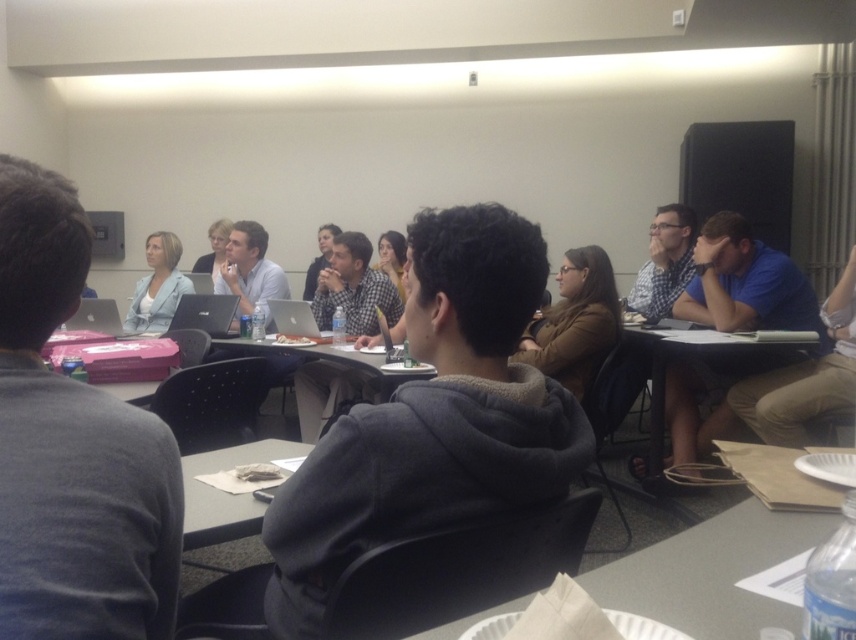
Question: Which of the following is the farthest from the observer?

Choices:
 (A) blue cotton shirt at right
 (B) gray fleece hoodie at center
 (C) white paper plate at lower center

Answer: (A)

Question: Which is farther from the matte black jacket at center?

Choices:
 (A) light blue blazer at upper left
 (B) white paper plate at lower center

Answer: (A)

Question: Where is matte white shirt at upper center located in relation to matte black jacket at center in the image?

Choices:
 (A) above
 (B) below

Answer: (A)

Question: Can you confirm if light brown hair at center is bigger than matte black jacket at center?

Choices:
 (A) no
 (B) yes

Answer: (A)

Question: Can you confirm if white paper plate at lower center is bigger than matte black jacket at center?

Choices:
 (A) no
 (B) yes

Answer: (A)

Question: Which point is farther from the camera taking this photo?

Choices:
 (A) (592, 579)
 (B) (391, 234)

Answer: (B)